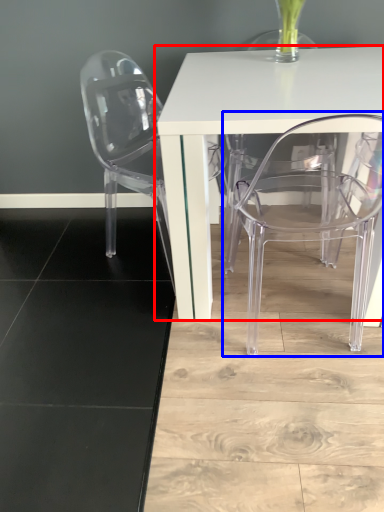
Question: Which point is closer to the camera, table (highlighted by a red box) or chair (highlighted by a blue box)?

Choices:
 (A) table
 (B) chair

Answer: (B)